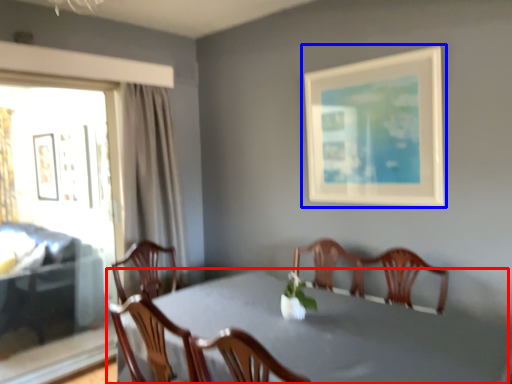
Question: Which point is further to the camera, table (highlighted by a red box) or picture frame (highlighted by a blue box)?

Choices:
 (A) table
 (B) picture frame

Answer: (B)